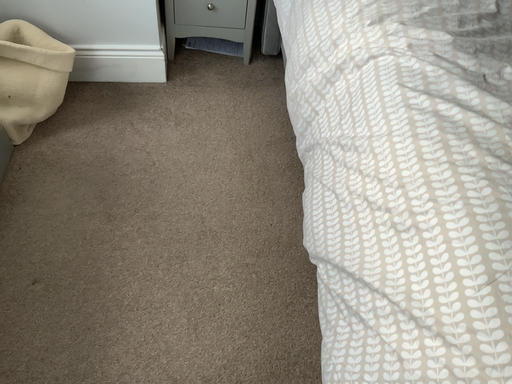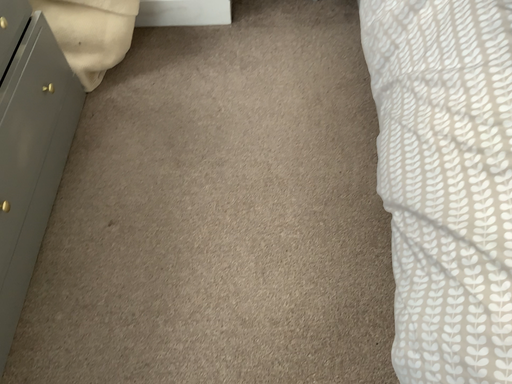
Question: How did the camera likely rotate when shooting the video?

Choices:
 (A) rotated downward
 (B) rotated upward

Answer: (A)